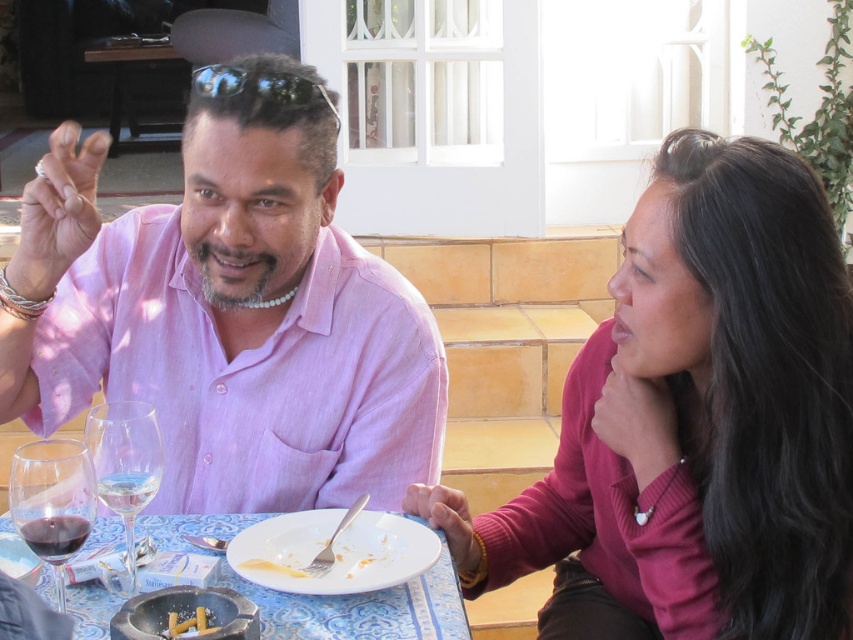
Question: Among these objects, which one is nearest to the camera?

Choices:
 (A) white matte plate at center
 (B) translucent glass wine glass at lower left

Answer: (B)

Question: Which object is the closest to the charred wood skewers at center?

Choices:
 (A) pink linen shirt at center
 (B) translucent glass wine glass at lower left
 (C) white matte plate at center
 (D) porcelain plate at center

Answer: (B)

Question: In this image, where is black reflective sunglasses at upper center located relative to charred wood skewers at center?

Choices:
 (A) above
 (B) below

Answer: (A)

Question: Can you confirm if matte pink sweater at right is positioned to the right of black reflective sunglasses at upper center?

Choices:
 (A) yes
 (B) no

Answer: (A)

Question: Among these objects, which one is nearest to the camera?

Choices:
 (A) clear glass wine glass at lower left
 (B) charred wood skewers at center

Answer: (B)

Question: Can you confirm if white matte plate at center is positioned to the left of charred wood skewers at center?

Choices:
 (A) no
 (B) yes

Answer: (A)